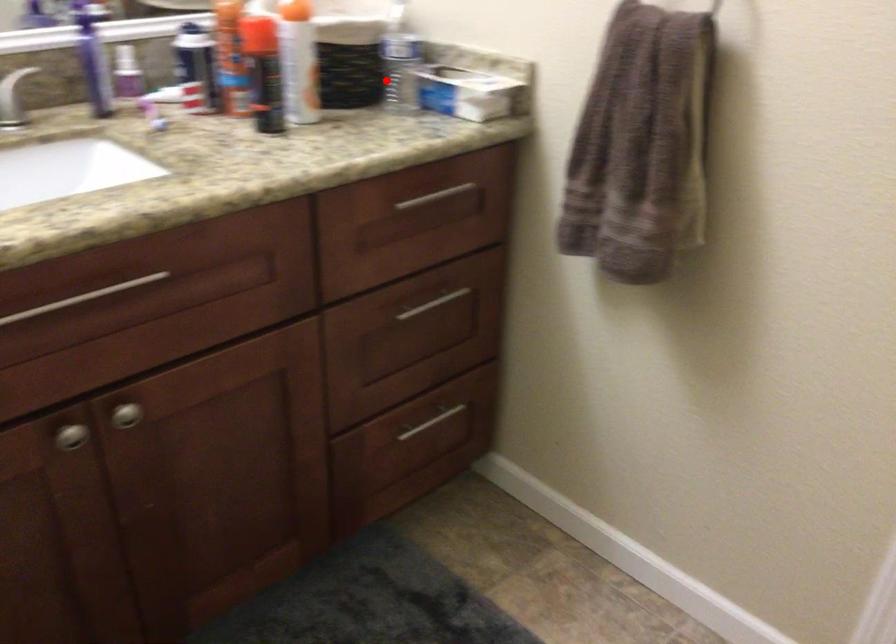
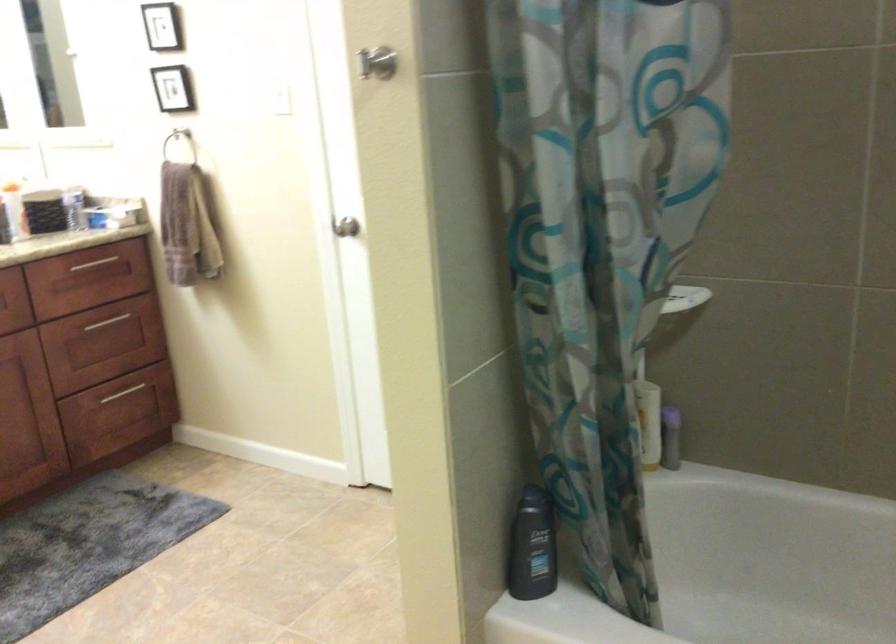
The point at the highlighted location is marked in the first image. Where is the corresponding point in the second image?

(73, 207)